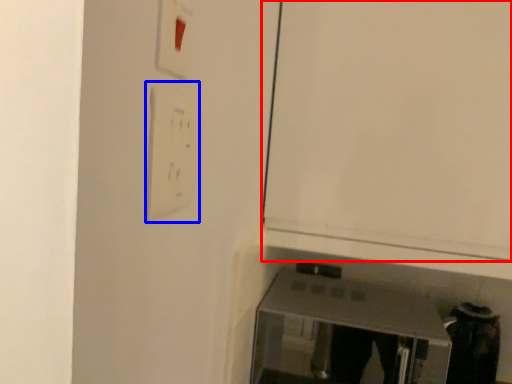
Question: Which of the following is the closest to the observer, door (highlighted by a red box) or light switch (highlighted by a blue box)?

Choices:
 (A) door
 (B) light switch

Answer: (B)